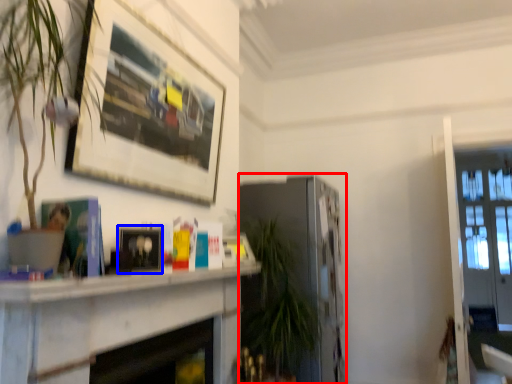
Question: Which of the following is the closest to the observer, fireplace (highlighted by a red box) or picture frame (highlighted by a blue box)?

Choices:
 (A) fireplace
 (B) picture frame

Answer: (B)